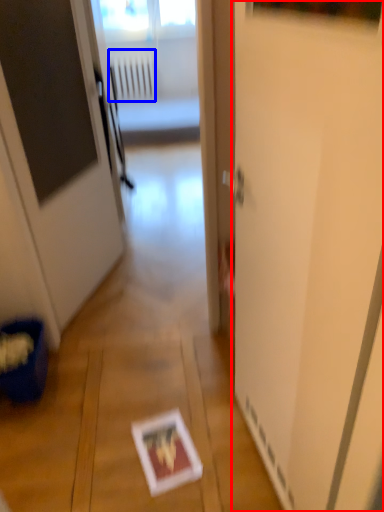
Question: Among these objects, which one is nearest to the camera, screen door (highlighted by a red box) or radiator (highlighted by a blue box)?

Choices:
 (A) screen door
 (B) radiator

Answer: (A)